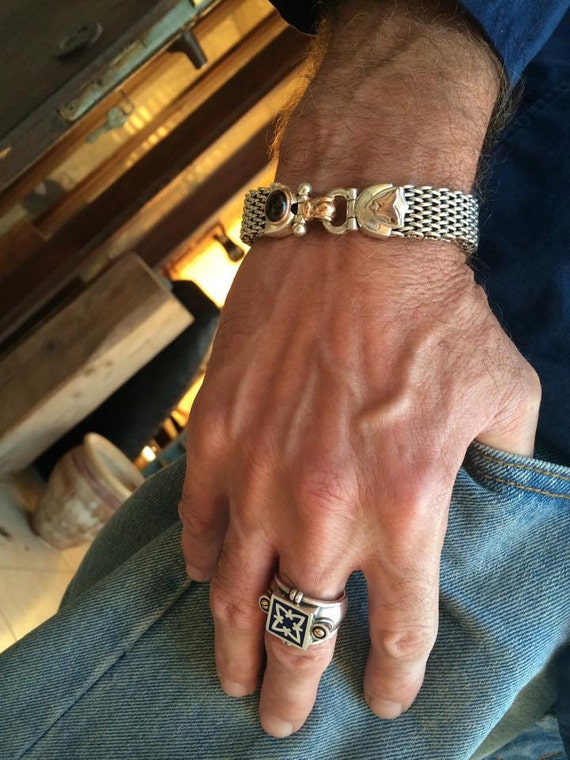
Where is `white floor in background`? The height and width of the screenshot is (760, 570). white floor in background is located at coordinates (11, 597).